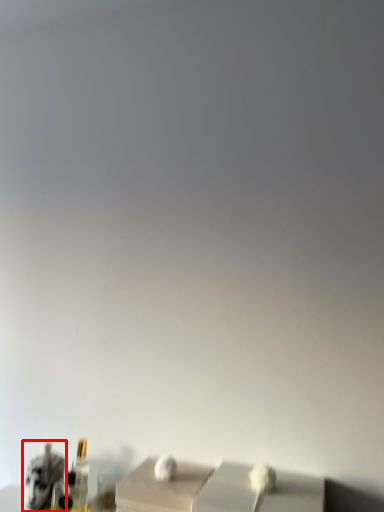
Question: Where is animal (annotated by the red box) located in relation to bottle in the image?

Choices:
 (A) left
 (B) right

Answer: (A)